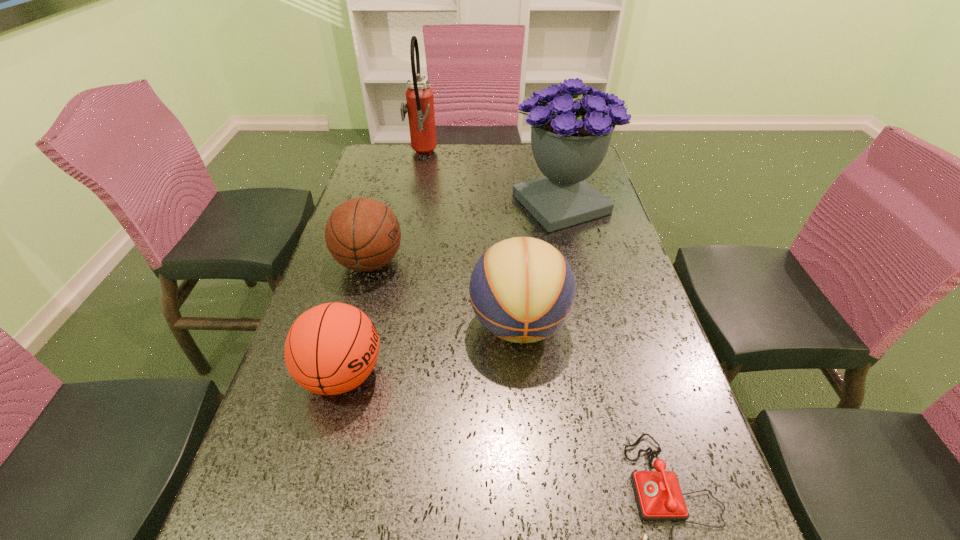
This screenshot has width=960, height=540. In order to click on the farthest object in this screenshot , I will do `click(420, 104)`.

I want to click on bouquet, so click(569, 140).

At what (x,y) coordinates should I click in order to perform the action: click on the rightmost basketball. Please return your answer as a coordinate pair (x, y). The width and height of the screenshot is (960, 540). Looking at the image, I should click on (522, 289).

Locate an element on the screen. the fourth shortest object is located at coordinates (522, 289).

You are a GUI agent. You are given a task and a screenshot of the screen. Output one action in this format:
    pyautogui.click(x=<x>, y=<y>)
    Task: Click on the third farthest object
    
    Given the screenshot: What is the action you would take?
    pyautogui.click(x=362, y=234)

Locate an element on the screen. The width and height of the screenshot is (960, 540). vacant area situated 0.280m at the nozzle of the farthest object is located at coordinates (514, 154).

Image resolution: width=960 pixels, height=540 pixels. Identify the location of vacant region located on the left of the second farthest object. (422, 204).

You are a GUI agent. You are given a task and a screenshot of the screen. Output one action in this format:
    pyautogui.click(x=<x>, y=<y>)
    Task: Click on the vacant region located on the patterned surface of the third tallest object
    Image resolution: width=960 pixels, height=540 pixels.
    Given the screenshot: What is the action you would take?
    pyautogui.click(x=531, y=464)

Where is `vacant area situated 0.300m on the side with brand label of the fourth nearest object`? vacant area situated 0.300m on the side with brand label of the fourth nearest object is located at coordinates (517, 262).

I want to click on object positioned at the far edge, so click(420, 104).